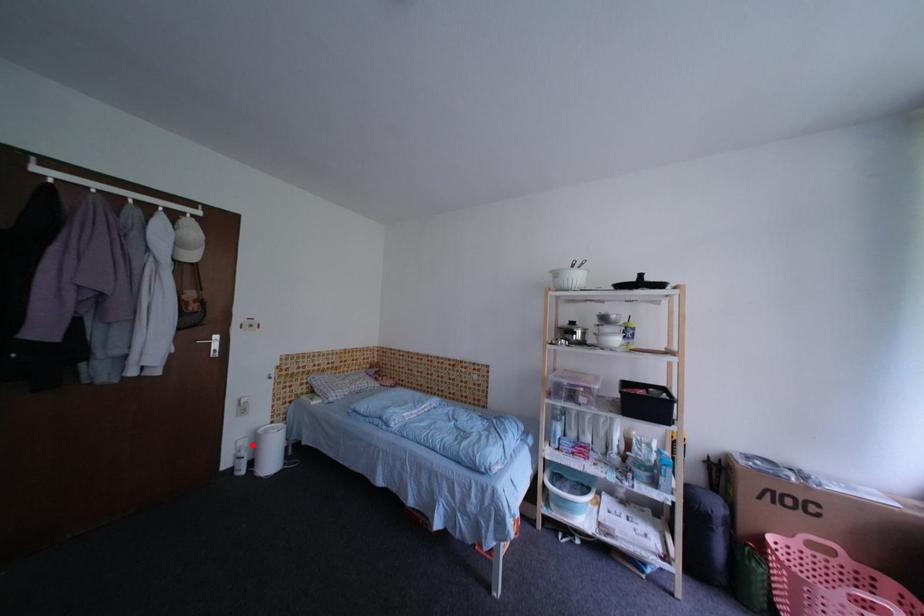
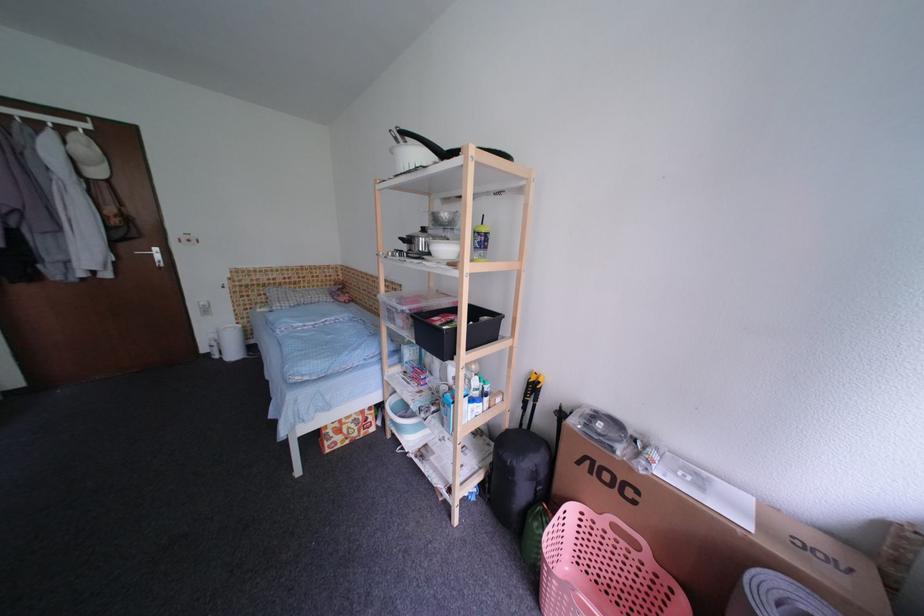
Question: I am providing you with two images of the same scene from different viewpoints. Image1 has a red point marked. In image2, the corresponding 3D location appears at what relative position? Reply with the corresponding letter.

Choices:
 (A) Closer
 (B) Farther

Answer: (A)